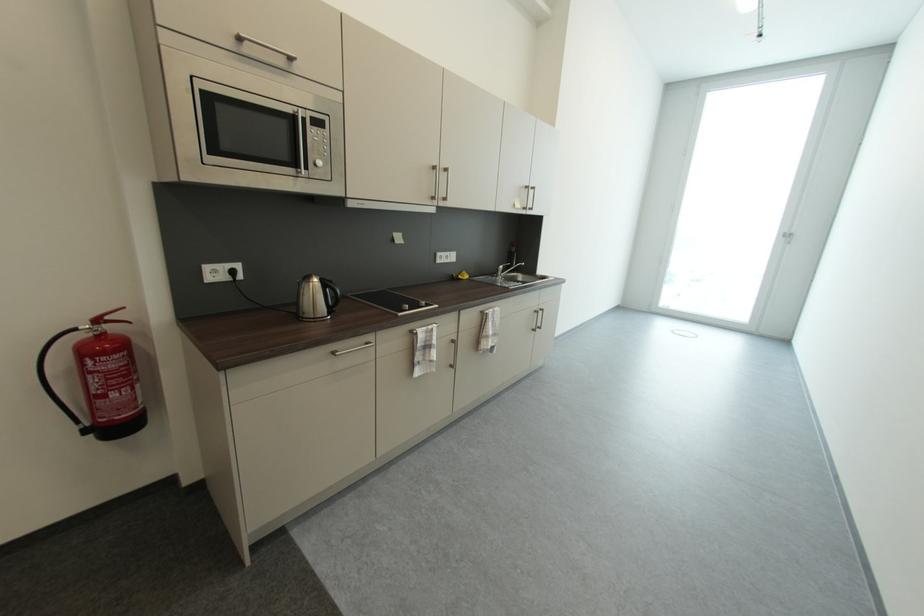
The width and height of the screenshot is (924, 616). Find the location of `microwave control button`. microwave control button is located at coordinates (318, 161).